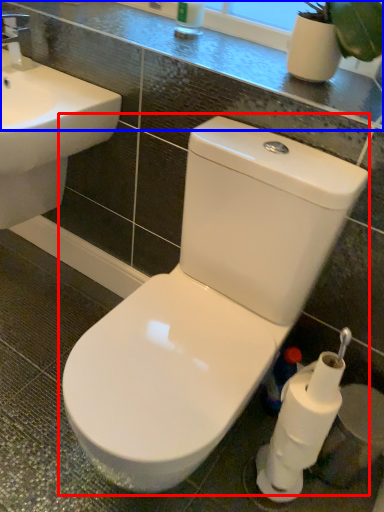
Question: Among these objects, which one is nearest to the camera, toilet (highlighted by a red box) or counter top (highlighted by a blue box)?

Choices:
 (A) toilet
 (B) counter top

Answer: (A)